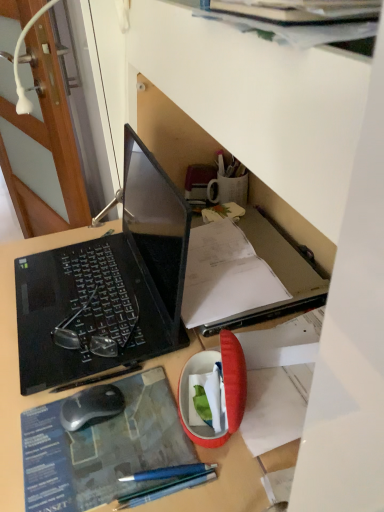
The width and height of the screenshot is (384, 512). What are the coordinates of `free space in front of silver matte computer mouse at lower left` in the screenshot? It's located at (78, 467).